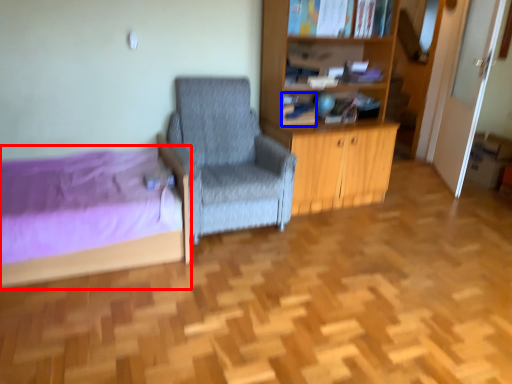
Question: Which object appears closest to the camera in this image, bed (highlighted by a red box) or book (highlighted by a blue box)?

Choices:
 (A) bed
 (B) book

Answer: (A)